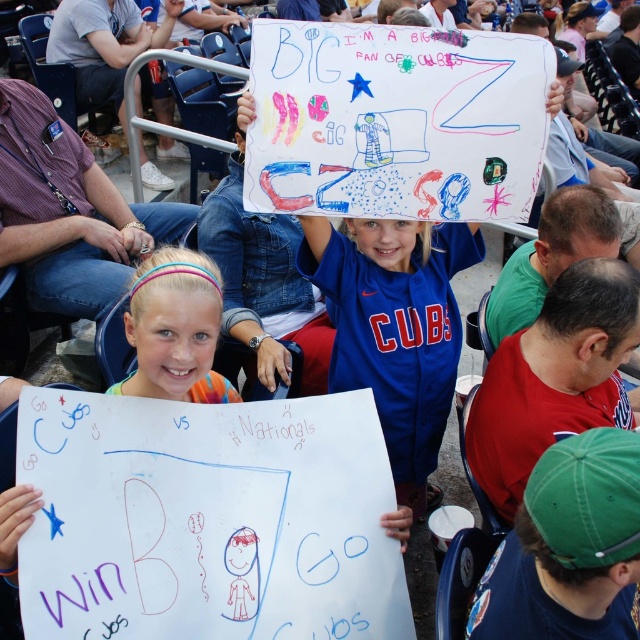
Question: Does blue jersey at center have a lesser width compared to pastel hairband at center?

Choices:
 (A) yes
 (B) no

Answer: (B)

Question: Which of the following is the closest to the observer?

Choices:
 (A) pastel hairband at center
 (B) blue jersey at center

Answer: (A)

Question: Among these objects, which one is farthest from the camera?

Choices:
 (A) pastel hairband at center
 (B) blue jersey at center

Answer: (B)

Question: Where is blue jersey at center located in relation to pastel hairband at center in the image?

Choices:
 (A) left
 (B) right

Answer: (B)

Question: Is blue jersey at center to the left of pastel hairband at center from the viewer's perspective?

Choices:
 (A) no
 (B) yes

Answer: (A)